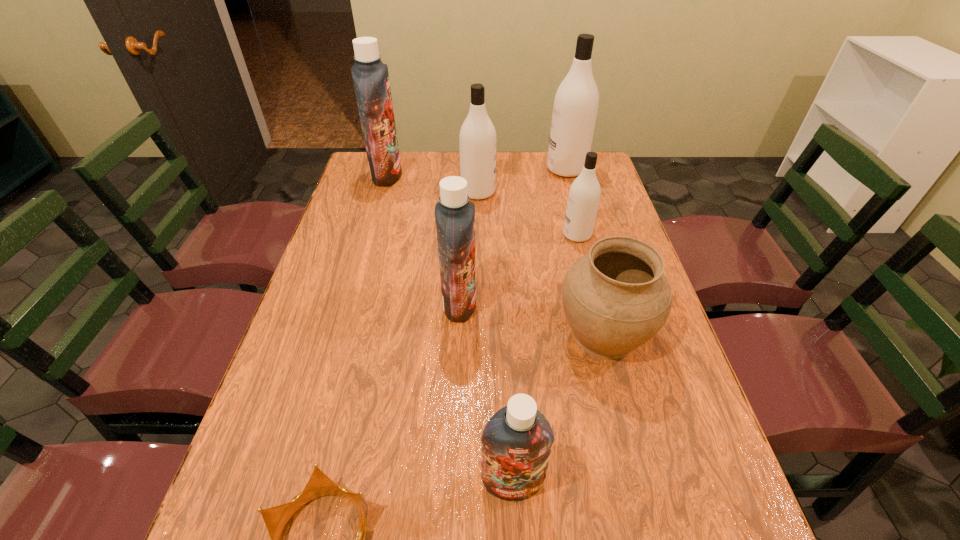
Locate which shampoo is the second closest to the crown. Please provide its 2D coordinates. Your answer should be formatted as a tuple, i.e. [(x, y)], where the tuple contains the x and y coordinates of a point satisfying the conditions above.

[(454, 213)]

Choose which shampoo is the third nearest neighbor to the fourth farthest object. Please provide its 2D coordinates. Your answer should be formatted as a tuple, i.e. [(x, y)], where the tuple contains the x and y coordinates of a point satisfying the conditions above.

[(454, 213)]

Select which white shampoo is the third closest to the urn. Please provide its 2D coordinates. Your answer should be formatted as a tuple, i.e. [(x, y)], where the tuple contains the x and y coordinates of a point satisfying the conditions above.

[(576, 101)]

This screenshot has width=960, height=540. I want to click on white shampoo that is the third closest one to the nearest shampoo, so click(576, 101).

Choose which blue shampoo is the third nearest neighbor to the fourth farthest object. Please provide its 2D coordinates. Your answer should be formatted as a tuple, i.e. [(x, y)], where the tuple contains the x and y coordinates of a point satisfying the conditions above.

[(517, 440)]

Locate an element on the screen. The height and width of the screenshot is (540, 960). blue shampoo that stands as the third closest to the leftmost white shampoo is located at coordinates (517, 440).

Locate an element on the screen. Image resolution: width=960 pixels, height=540 pixels. vacant position in the image that satisfies the following two spatial constraints: 1. on the front label of the second biggest blue shampoo; 2. on the right side of the urn is located at coordinates (458, 334).

Where is `vacant space that satisfies the following two spatial constraints: 1. on the front-facing side of the urn; 2. on the right side of the leftmost white shampoo`? The image size is (960, 540). vacant space that satisfies the following two spatial constraints: 1. on the front-facing side of the urn; 2. on the right side of the leftmost white shampoo is located at coordinates (477, 334).

The width and height of the screenshot is (960, 540). I want to click on free region that satisfies the following two spatial constraints: 1. on the front-facing side of the farthest white shampoo; 2. on the front side of the urn, so [x=611, y=334].